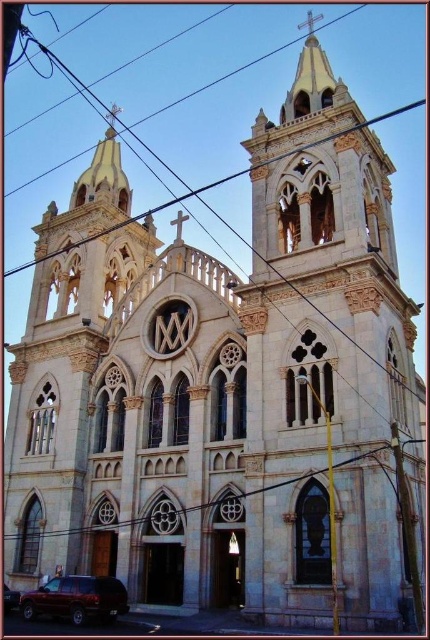
You are a delivery driver who needs to park your truck, which is 2 meters tall, in the parking lot near the church. You see the maroon matte suv at lower left and the matte black suv at lower left. Can your truck fit between them if the space between them is exactly 2.1 meters tall?

The maroon matte suv at lower left is taller than the matte black suv at lower left. Since the tallest object between them is the maroon matte suv at lower left, and the space between them is 2.1 meters, which is higher than your truck height of 2 meters, your truck can fit between them.

You are a delivery driver and need to park your maroon matte suv at lower left in a parking spot that is 50 meters away from the church entrance. Is your current position within the required distance?

The maroon matte suv at lower left is 48.37 meters away from the church entrance, so yes, it is within the required 50 meters distance.